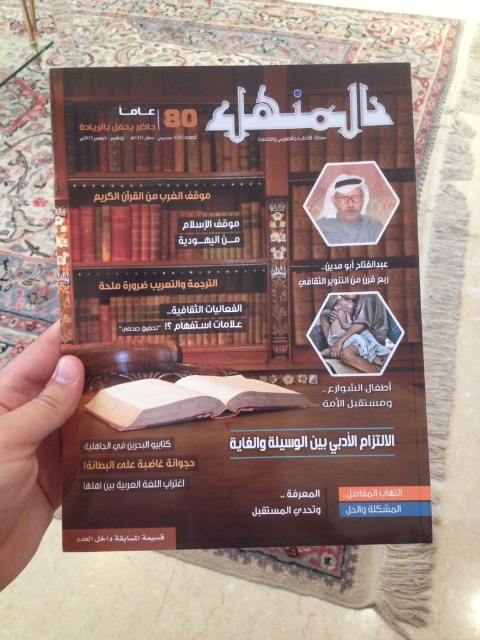
You are looking at a bookshelf in the library. You see an open book at center and a hardcover book at center. Which book is closer to the bottom of the shelf?

The open book at center is closer to the bottom of the shelf because it is positioned below the hardcover book at center.

You are organizing a library shelf and have both an open book at center and a hardcover book at center. If you want to place them side by side without overlapping, which one should you place first to ensure they fit?

The open book at center is larger in size than the hardcover book at center, so you should place the open book at center first to accommodate its larger size before placing the hardcover book at center.